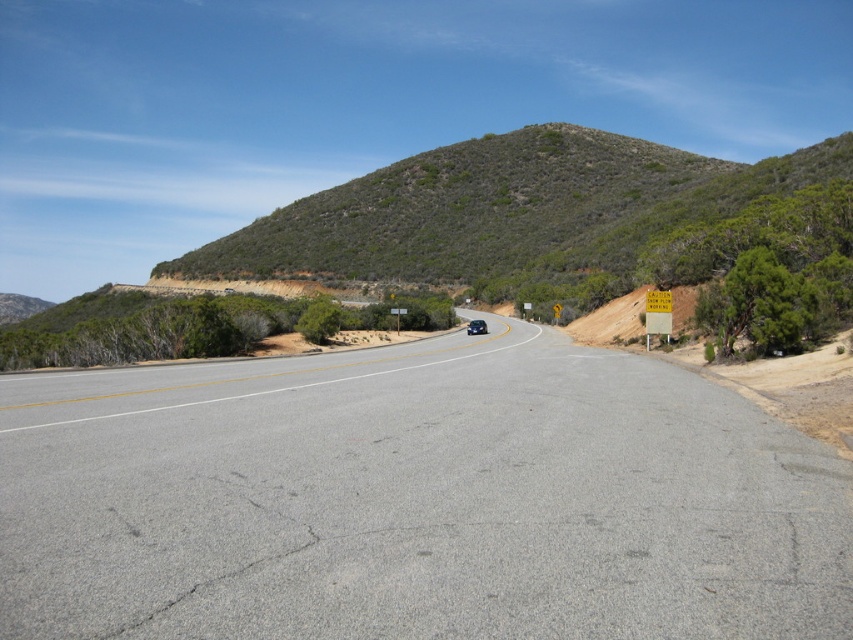
Between point (90, 492) and point (480, 320), which one is positioned behind?

Point (480, 320)

Which of these two, gray asphalt road at center or satin blue sedan at center, stands shorter?

gray asphalt road at center

At what (x,y) coordinates should I click in order to perform the action: click on gray asphalt road at center. Please return your answer as a coordinate pair (x, y). The width and height of the screenshot is (853, 640). Looking at the image, I should click on (416, 499).

Who is lower down, yellow paper street sign at right or satin blue sedan at center?

Positioned lower is satin blue sedan at center.

Where is `yellow paper street sign at right`? yellow paper street sign at right is located at coordinates (657, 314).

Is gray asphalt road at center to the left of yellow paper street sign at right from the viewer's perspective?

Correct, you'll find gray asphalt road at center to the left of yellow paper street sign at right.

How distant is gray asphalt road at center from yellow paper street sign at right?

18.70 meters

Does point (370, 371) come behind point (666, 298)?

No, (370, 371) is in front of (666, 298).

The image size is (853, 640). I want to click on gray asphalt road at center, so click(x=416, y=499).